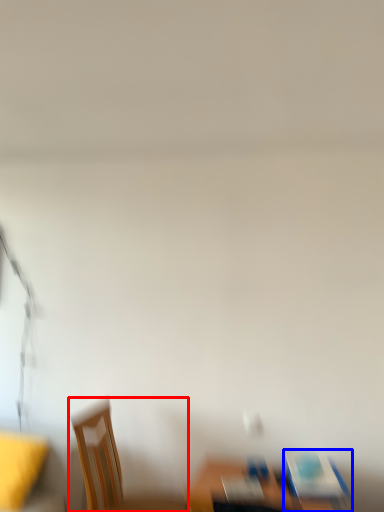
Question: Which of the following is the farthest to the observer, chair (highlighted by a red box) or chair (highlighted by a blue box)?

Choices:
 (A) chair
 (B) chair

Answer: (A)